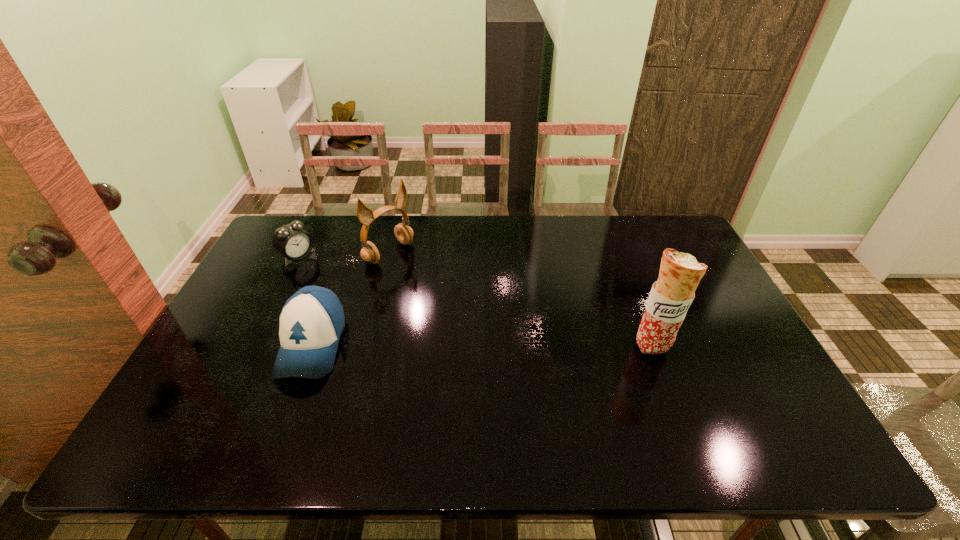
At what (x,y) coordinates should I click in order to perform the action: click on free location at the right edge. Please return your answer as a coordinate pair (x, y). The height and width of the screenshot is (540, 960). Looking at the image, I should click on (654, 259).

The height and width of the screenshot is (540, 960). In order to click on vacant space in between the baseball cap and the second tallest object in this screenshot , I will do `click(350, 299)`.

Where is `vacant area between the rightmost object and the baseball cap`? vacant area between the rightmost object and the baseball cap is located at coordinates (482, 345).

I want to click on free space between the rightmost object and the baseball cap, so click(482, 345).

You are a GUI agent. You are given a task and a screenshot of the screen. Output one action in this format:
    pyautogui.click(x=<x>, y=<y>)
    Task: Click on the empty space between the second tallest object and the burrito
    This screenshot has height=540, width=960.
    Given the screenshot: What is the action you would take?
    pyautogui.click(x=520, y=299)

Find the location of a particular element. The width and height of the screenshot is (960, 540). vacant space in between the baseball cap and the rightmost object is located at coordinates (482, 345).

Find the location of a particular element. vacant space that's between the leftmost object and the rightmost object is located at coordinates (475, 301).

Where is `free spot between the earphone and the rightmost object`? This screenshot has height=540, width=960. free spot between the earphone and the rightmost object is located at coordinates (520, 299).

Where is `free point between the earphone and the rightmost object`? free point between the earphone and the rightmost object is located at coordinates (520, 299).

This screenshot has width=960, height=540. Find the location of `object that is the third nearest to the earphone`. object that is the third nearest to the earphone is located at coordinates (680, 273).